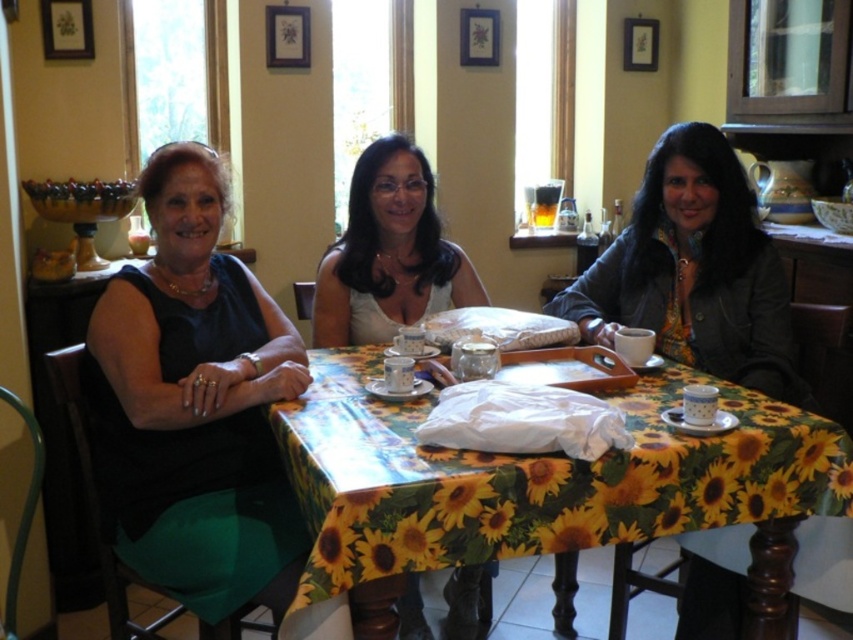
Can you confirm if white matte dress at center is positioned above matte white blouse at center?

No.

Does white matte dress at center have a greater width compared to matte white blouse at center?

No, white matte dress at center is not wider than matte white blouse at center.

Is point (461, 636) more distant than point (372, 164)?

Yes, point (461, 636) is farther from viewer.

I want to click on white matte dress at center, so click(x=389, y=253).

Which is below, yellow floral tablecloth at center or black satin dress at left?

yellow floral tablecloth at center

Is point (375, 444) in front of point (279, 554)?

Yes, point (375, 444) is in front of point (279, 554).

Image resolution: width=853 pixels, height=640 pixels. What are the coordinates of `yellow floral tablecloth at center` in the screenshot? It's located at (531, 477).

Can you confirm if leather jacket at right is positioned to the right of white matte dress at center?

Indeed, leather jacket at right is positioned on the right side of white matte dress at center.

Who is positioned more to the left, leather jacket at right or white matte dress at center?

white matte dress at center

Image resolution: width=853 pixels, height=640 pixels. Describe the element at coordinates (694, 269) in the screenshot. I see `leather jacket at right` at that location.

This screenshot has width=853, height=640. Identify the location of leather jacket at right. (694, 269).